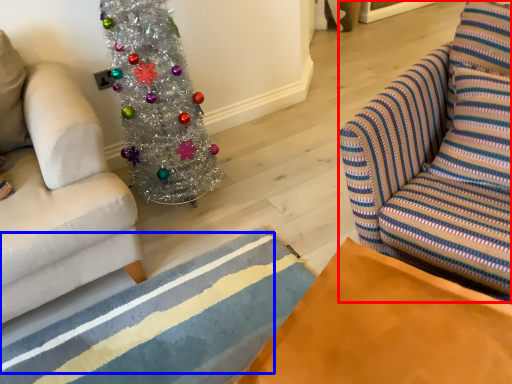
Question: Which point is further to the camera, swivel chair (highlighted by a red box) or stripe (highlighted by a blue box)?

Choices:
 (A) swivel chair
 (B) stripe

Answer: (B)